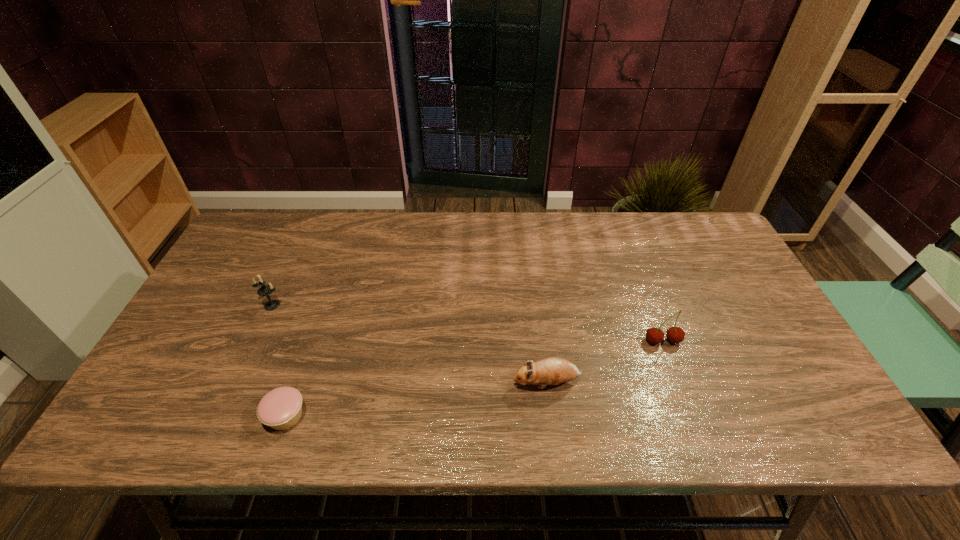
Locate an element on the screen. unoccupied position between the third object from right to left and the leftmost object is located at coordinates (279, 361).

What are the coordinates of `empty location between the cupcake and the second object from right to left` in the screenshot? It's located at (416, 400).

Identify the location of free space that is in between the hamster and the candle holder. The image size is (960, 540). (409, 344).

Identify which object is located as the third nearest to the candle holder. Please provide its 2D coordinates. Your answer should be formatted as a tuple, i.e. [(x, y)], where the tuple contains the x and y coordinates of a point satisfying the conditions above.

[(675, 335)]

Select which object is the second closest to the second object from right to left. Please provide its 2D coordinates. Your answer should be formatted as a tuple, i.e. [(x, y)], where the tuple contains the x and y coordinates of a point satisfying the conditions above.

[(281, 408)]

The image size is (960, 540). Find the location of `free space that satisfies the following two spatial constraints: 1. on the surface of the third nearest object; 2. at the face of the third tallest object`. free space that satisfies the following two spatial constraints: 1. on the surface of the third nearest object; 2. at the face of the third tallest object is located at coordinates (678, 383).

Where is `vacant point that satisfies the following two spatial constraints: 1. on the surface of the second farthest object; 2. at the face of the third farthest object`? The image size is (960, 540). vacant point that satisfies the following two spatial constraints: 1. on the surface of the second farthest object; 2. at the face of the third farthest object is located at coordinates (678, 383).

The width and height of the screenshot is (960, 540). Identify the location of free region that satisfies the following two spatial constraints: 1. on the surface of the second farthest object; 2. at the face of the third farthest object. (678, 383).